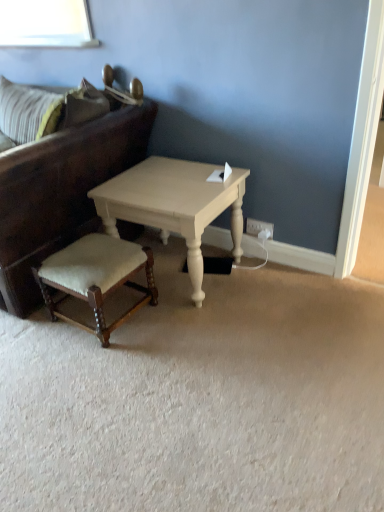
The width and height of the screenshot is (384, 512). Find the location of `vacant area situated to the left side of velvet beige stool at lower left`. vacant area situated to the left side of velvet beige stool at lower left is located at coordinates (26, 336).